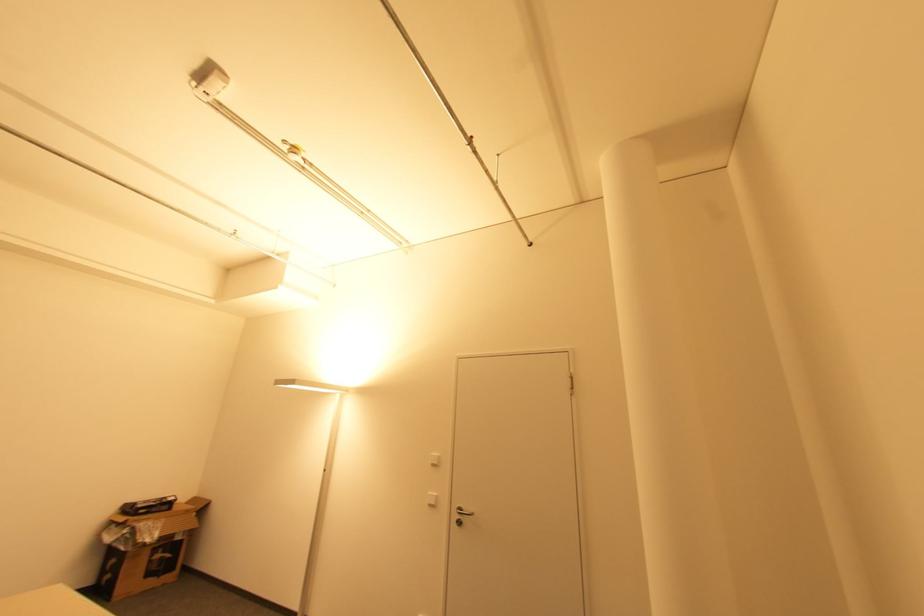
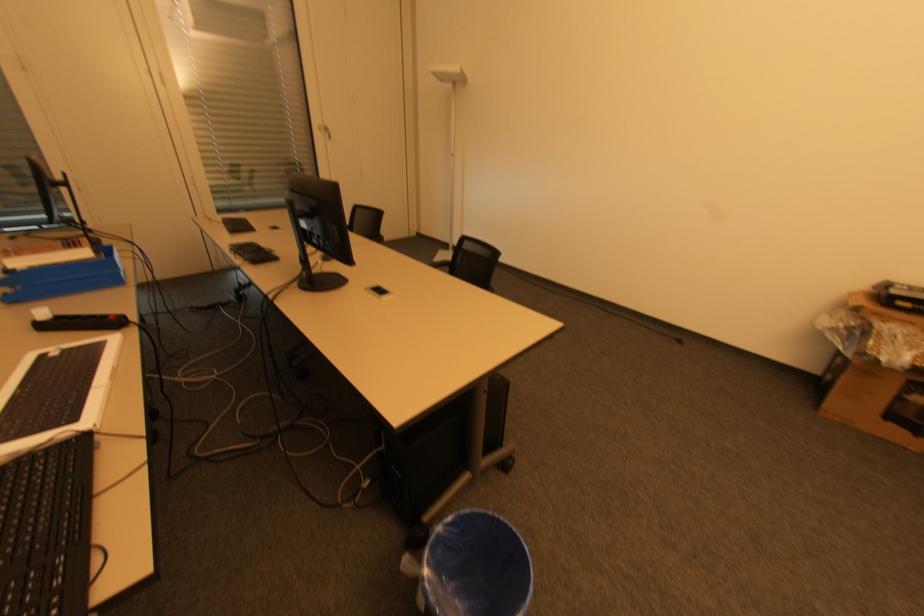
In the second image, find the point that corresponds to (126,535) in the first image.

(850, 328)